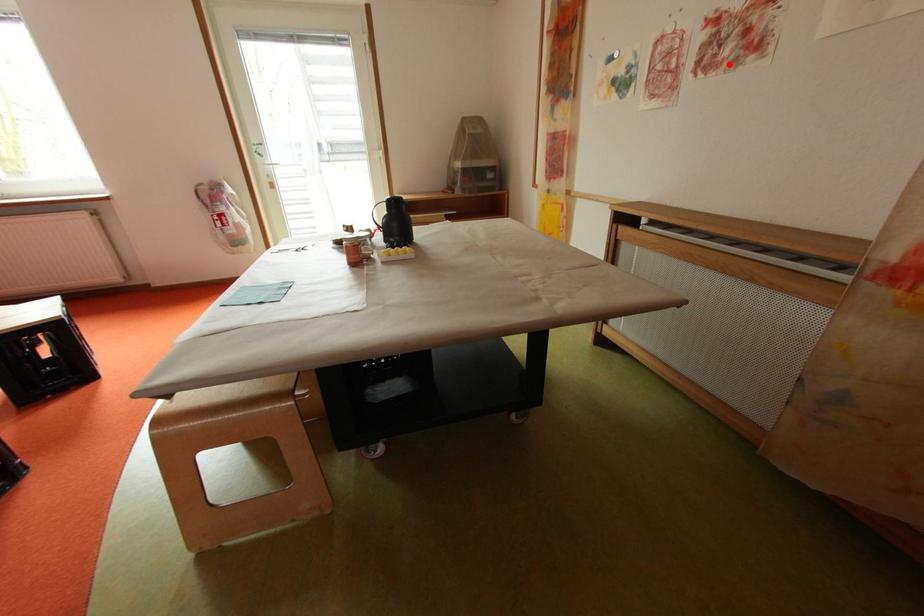
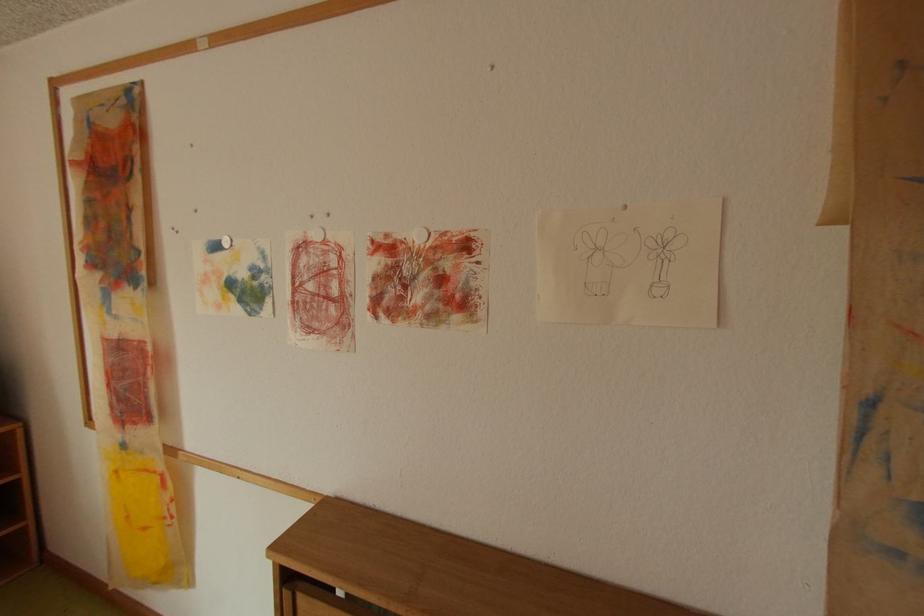
Locate, in the second image, the point that corresponds to the highlighted location in the first image.

(420, 313)